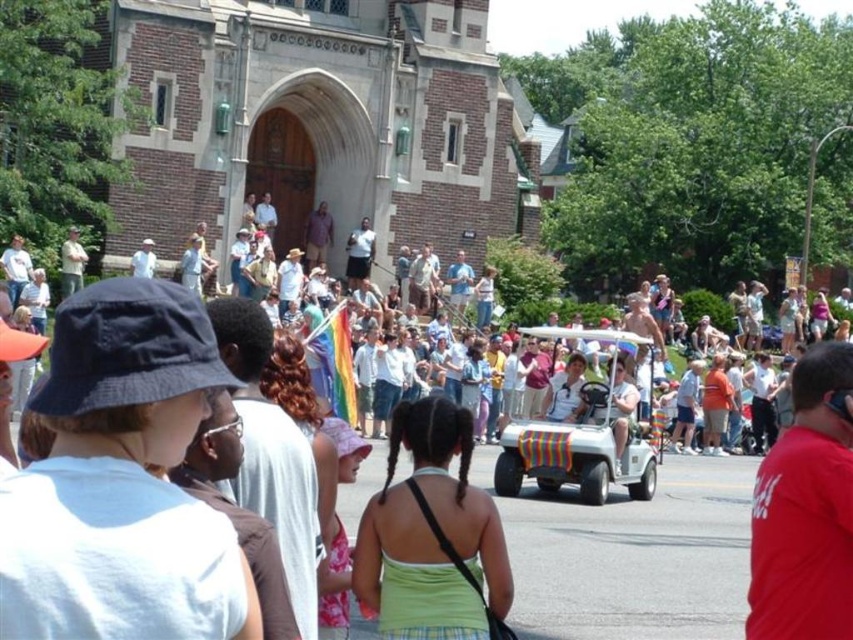
You are standing at the point marked as point (431, 534) in the image. What object is exactly at this location?

The green fabric dress at center is exactly located at point (431, 534).